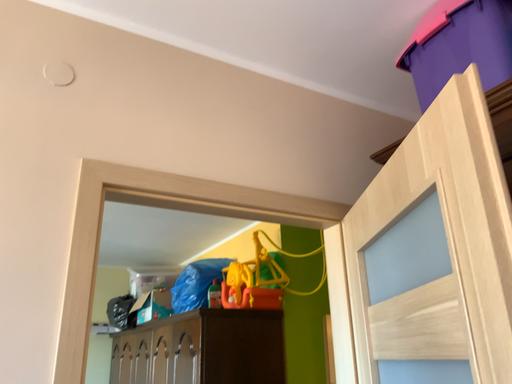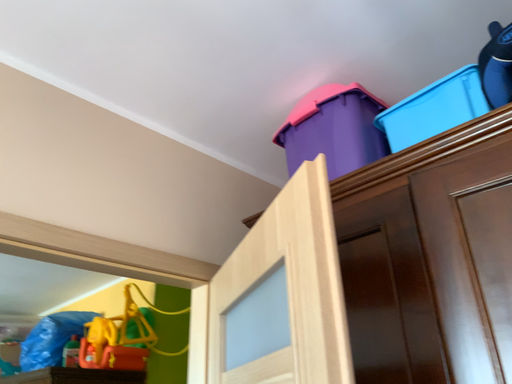
Question: How did the camera likely rotate when shooting the video?

Choices:
 (A) rotated downward
 (B) rotated upward

Answer: (B)